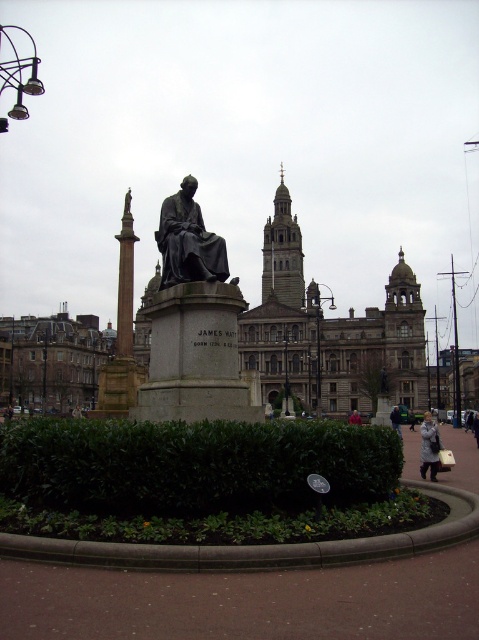
You are a landscape architect evaluating the public square. You need to determine if the green leafy hedge at center can be seen from behind the bronze statue at center. Based on their heights, what is your conclusion?

The green leafy hedge at center has a lesser height compared to bronze statue at center, so the hedge is shorter than the statue. Therefore, the hedge would be obscured by the statue from behind, making it invisible from that vantage point.

You are a landscape architect planning to place a new bench in the public square. The bench requires a space that is at least 25 meters away from the bronze statue at center to ensure it doesn not obstruct the view of the statue. Based on the current layout, can the bench be placed near the green leafy hedge at center?

The green leafy hedge at center is 23.71 meters away from the bronze statue at center, which is less than the required 25 meters. Therefore, placing the bench near the green leafy hedge at center would not meet the distance requirement and might obstruct the view of the bronze statue at center.

You are a city planner assessing the public square. You need to determine if the green leafy hedge at center and bronze statue at center can be swapped in their current positions without altering their orientation. Based on their widths, will this be feasible?

The green leafy hedge at center is wider than the bronze statue at center. Swapping their positions would require the bronze statue at center to occupy the space currently taken by the wider hedge, which may not fit unless the area is expanded. Therefore, swapping them as is might not be feasible due to the width discrepancy.